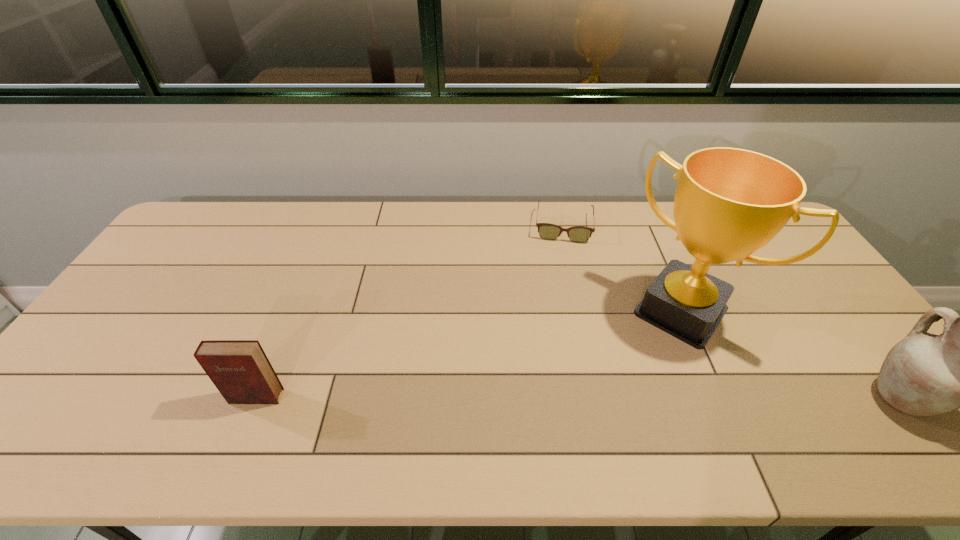
Image resolution: width=960 pixels, height=540 pixels. Identify the location of vacant space on the desktop that is between the leftmost object and the third shortest object and is positioned on the front-facing side of the second farthest object. (619, 397).

You are a GUI agent. You are given a task and a screenshot of the screen. Output one action in this format:
    pyautogui.click(x=<x>, y=<y>)
    Task: Click on the free spot on the desktop that is between the diary and the rightmost object and is positioned at the front view of the shortest object
    The width and height of the screenshot is (960, 540).
    Given the screenshot: What is the action you would take?
    pyautogui.click(x=557, y=397)